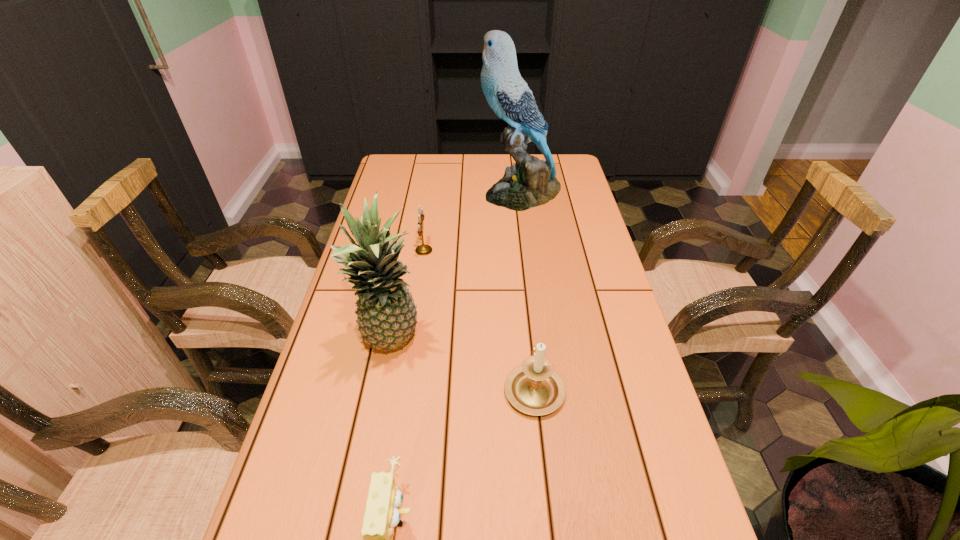
In the image, there is a desktop. Where is `free space at the far right corner`? free space at the far right corner is located at coordinates (561, 173).

You are a GUI agent. You are given a task and a screenshot of the screen. Output one action in this format:
    pyautogui.click(x=<x>, y=<y>)
    Task: Click on the free area in between the fourth shortest object and the farthest object
    
    Given the screenshot: What is the action you would take?
    pyautogui.click(x=456, y=268)

Point out which object is positioned as the nearest to the second tallest object. Please provide its 2D coordinates. Your answer should be formatted as a tuple, i.e. [(x, y)], where the tuple contains the x and y coordinates of a point satisfying the conditions above.

[(534, 388)]

Locate which object ranks third in proximity to the pineapple. Please provide its 2D coordinates. Your answer should be formatted as a tuple, i.e. [(x, y)], where the tuple contains the x and y coordinates of a point satisfying the conditions above.

[(382, 515)]